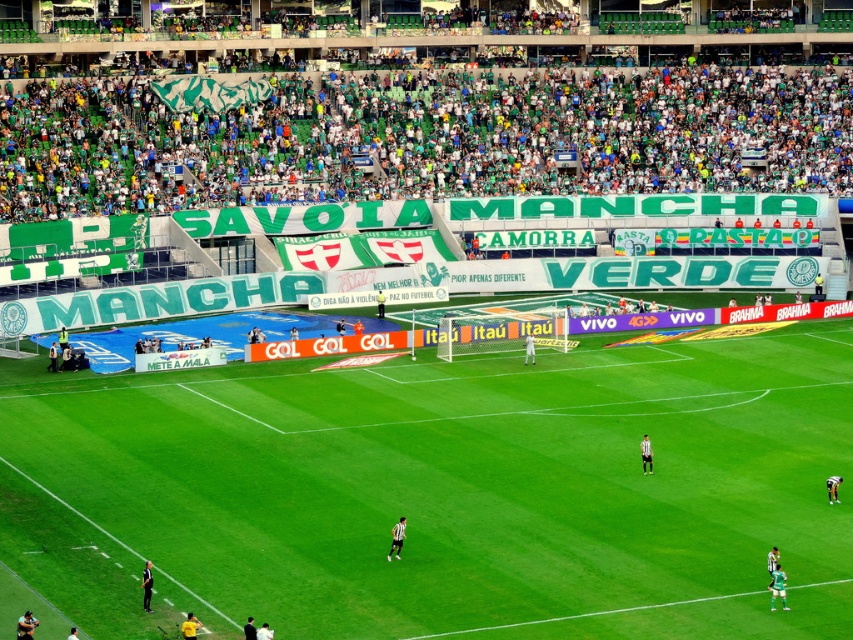
You are a photographer positioned at the center of the stadium. You want to take a photo of the black jersey at center. Which direction should you aim your camera to capture it?

The black jersey at center is located at point 0.842 on the x axis and 0.465 on the y axis. Since you are at the center, you should aim your camera towards the northeast direction to capture it.

You are a soccer referee standing at the edge of the field. You see the black jersey at center and the yellow jersey at lower left. Which player is closer to you?

The black jersey at center is closer to you because it is further to the viewer than the yellow jersey at lower left.

You are a soccer referee observing the match. You notice two players wearing a black jersey at center and a white jersey at center. Which player is positioned to the left of the other?

The black jersey at center is positioned on the left side of white jersey at center.